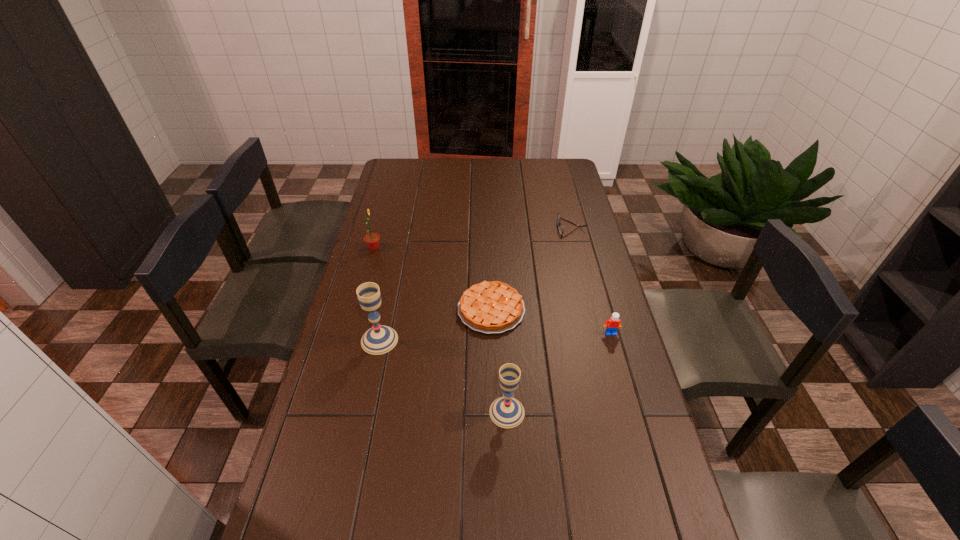
This screenshot has width=960, height=540. Find the location of `vacant space that is in between the farther chalice and the Lego`. vacant space that is in between the farther chalice and the Lego is located at coordinates click(495, 336).

What are the coordinates of `free space between the farthest object and the nearer chalice` in the screenshot? It's located at pyautogui.click(x=540, y=320).

What are the coordinates of `free space between the sunflower and the spectacles` in the screenshot? It's located at (472, 238).

This screenshot has height=540, width=960. Identify the location of free space between the leftmost object and the nearer chalice. (441, 330).

This screenshot has height=540, width=960. I want to click on free area in between the pie and the second farthest object, so click(433, 279).

Find the location of a particular element. Image resolution: width=960 pixels, height=540 pixels. object that is the third closest to the pie is located at coordinates (612, 325).

Image resolution: width=960 pixels, height=540 pixels. Identify the location of object identified as the fourth closest to the taller chalice. (612, 325).

Find the location of a particular element. free space in the image that satisfies the following two spatial constraints: 1. on the front side of the nearest object; 2. on the right side of the pie is located at coordinates (493, 412).

I want to click on free space that satisfies the following two spatial constraints: 1. on the face of the sunflower; 2. on the back side of the right chalice, so click(328, 412).

Locate an element on the screen. blank space that satisfies the following two spatial constraints: 1. on the back side of the fifth object from right to left; 2. on the right side of the pie is located at coordinates (386, 309).